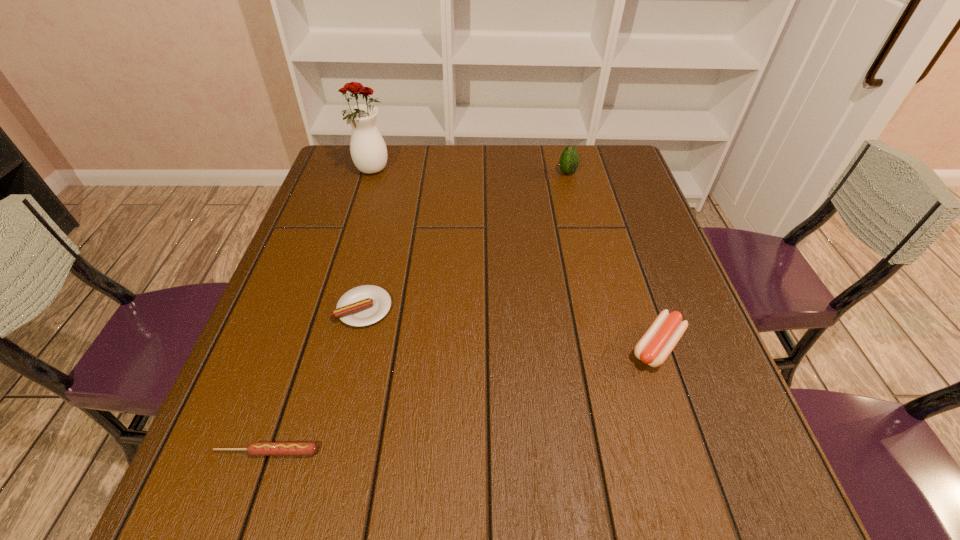
Locate an element on the screen. The image size is (960, 540). free region located on the front of the rightmost sausage is located at coordinates click(687, 435).

Where is `free space located on the front of the second tallest sausage`? Image resolution: width=960 pixels, height=540 pixels. free space located on the front of the second tallest sausage is located at coordinates [328, 462].

Where is `vacant space located 0.100m on the back of the nearest object`? vacant space located 0.100m on the back of the nearest object is located at coordinates (287, 392).

Identify the location of vase present at the far edge. (x=368, y=150).

This screenshot has width=960, height=540. Find the location of `avocado that is at the far edge`. avocado that is at the far edge is located at coordinates (569, 161).

Locate an element on the screen. The height and width of the screenshot is (540, 960). vase located at the left edge is located at coordinates (368, 150).

You are a GUI agent. You are given a task and a screenshot of the screen. Output one action in this format:
    pyautogui.click(x=<x>, y=<y>)
    Task: Click on the object situated at the right edge
    This screenshot has height=540, width=960.
    Given the screenshot: What is the action you would take?
    coord(657,343)

In order to click on object that is at the far left corner in this screenshot , I will do `click(368, 150)`.

Locate an element on the screen. The image size is (960, 540). vacant space at the far edge is located at coordinates (489, 187).

Find the location of a particular element. This screenshot has height=540, width=960. vacant space at the left edge of the desktop is located at coordinates (279, 284).